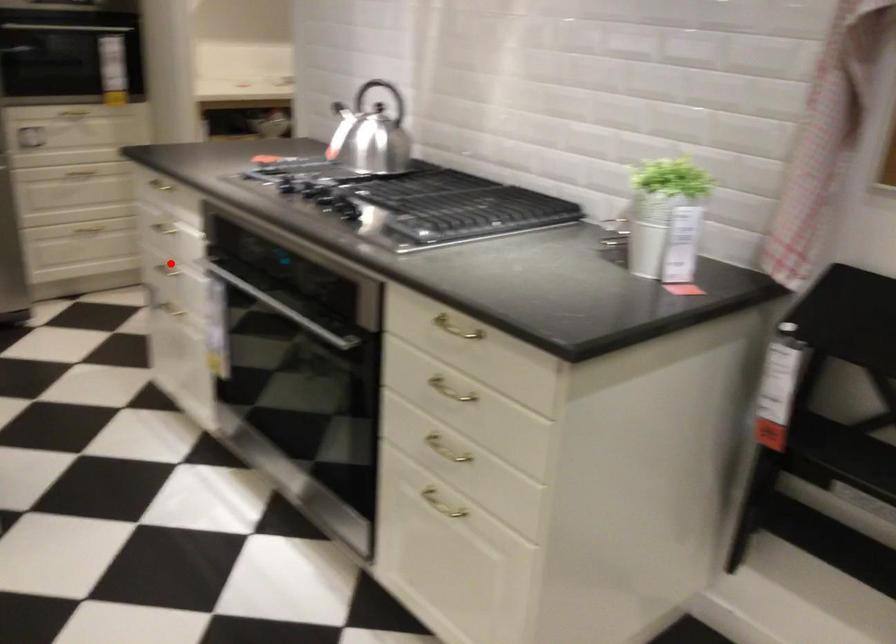
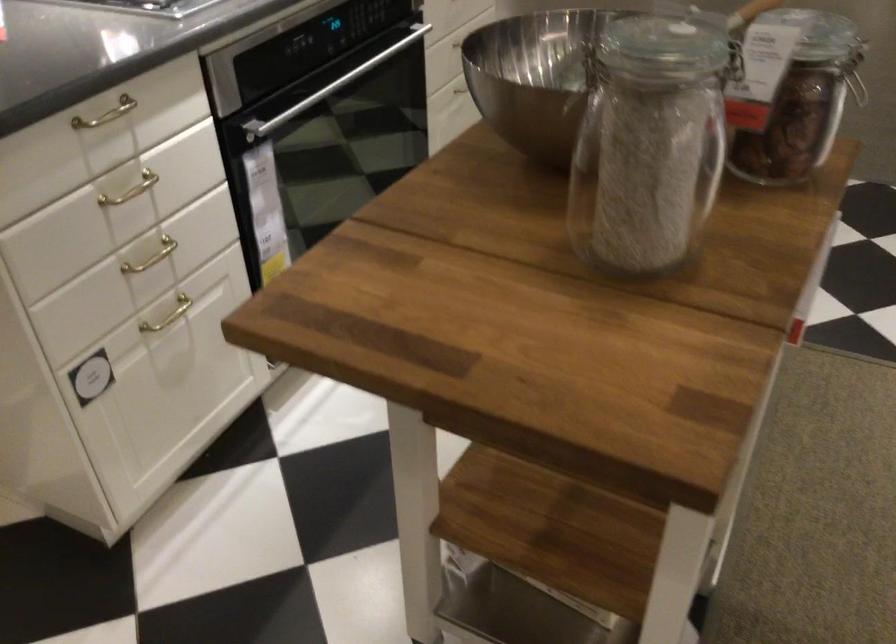
Question: A red point is marked in image1. In image2, is the corresponding 3D point closer to the camera or farther? Reply with the corresponding letter.

Choices:
 (A) The corresponding 3D point is closer.
 (B) The corresponding 3D point is farther.

Answer: (A)